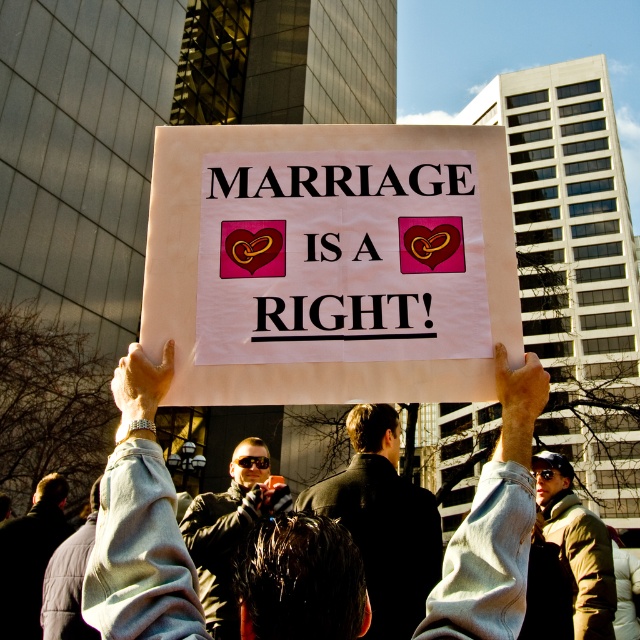
Question: Can you confirm if white paper sign at center is positioned below light gray sweatshirt at center?

Choices:
 (A) yes
 (B) no

Answer: (B)

Question: Where is white paper sign at center located in relation to light gray sweatshirt at center in the image?

Choices:
 (A) below
 (B) above

Answer: (B)

Question: Which object appears farthest from the camera in this image?

Choices:
 (A) white paper sign at center
 (B) light gray sweatshirt at center

Answer: (A)

Question: Among these objects, which one is farthest from the camera?

Choices:
 (A) white paper sign at center
 (B) light gray sweatshirt at center

Answer: (A)

Question: Does white paper sign at center come in front of light gray sweatshirt at center?

Choices:
 (A) no
 (B) yes

Answer: (A)